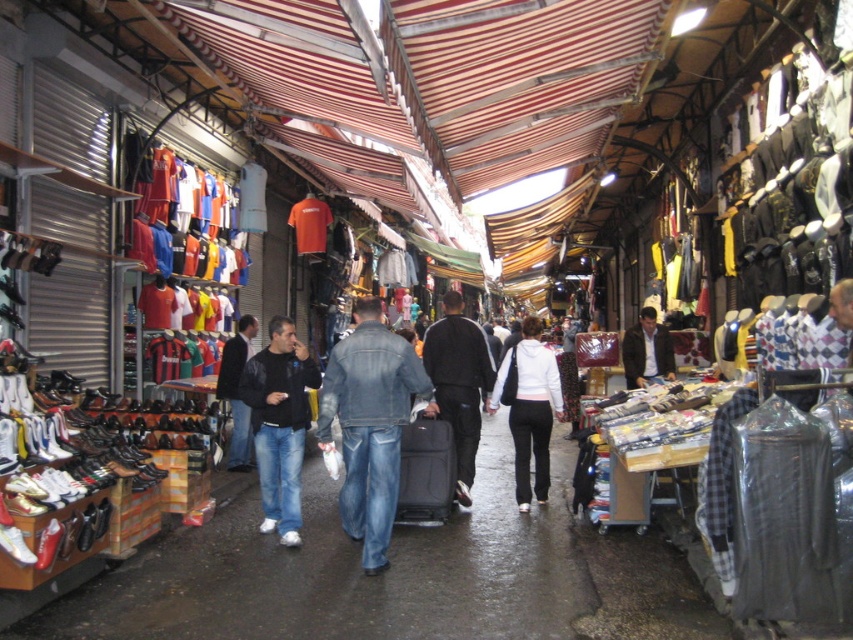
You are a customer trying to decide between the dark blue jeans at center and the white fleece pants at center. Which item is wider?

The dark blue jeans at center is wider than the white fleece pants at center.

You are a customer in the market looking for a leather jacket. You see the dark blue leather jacket at center and the dark brown leather jacket at center. Which one is smaller in size?

The dark blue leather jacket at center has a smaller size compared to the dark brown leather jacket at center.